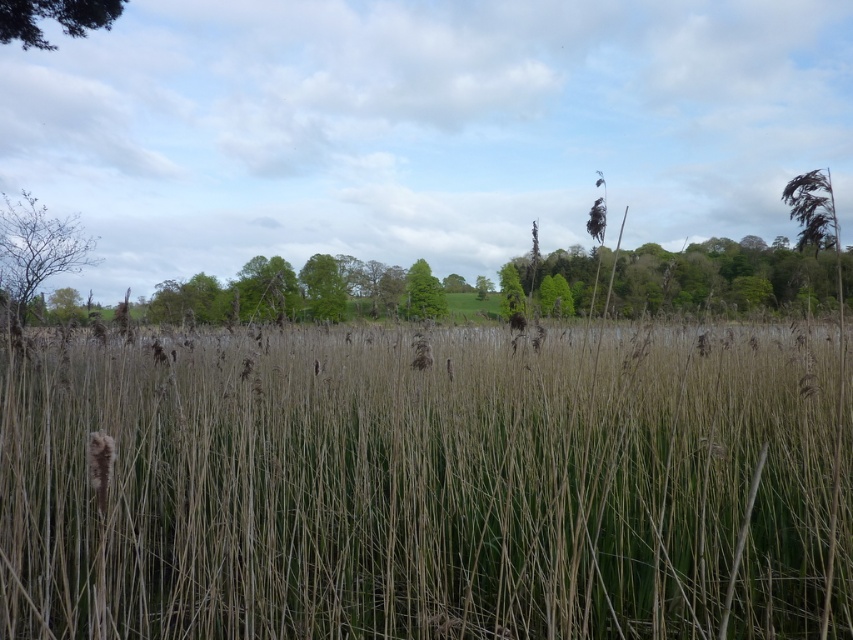
You are a hiker trying to cross the area between the dry grass at center and the green leafy tree at upper left. Which path would be wider for your movement?

The path near the dry grass at center is wider because its width is larger than that of the green leafy tree at upper left.

You are a hiker trying to cross the area between the dry grass at center and the green leafy tree at center. Which direction should you walk to avoid the wider vegetation?

The dry grass at center is wider than the green leafy tree at center, so you should walk towards the green leafy tree at center to avoid the wider vegetation.

You are standing in the middle of the reeds and see the dry grass at center and the green leafy tree at upper center. Which object is closer to you?

The dry grass at center is closer to you because it is positioned under the green leafy tree at upper center, indicating it is in a lower plane.